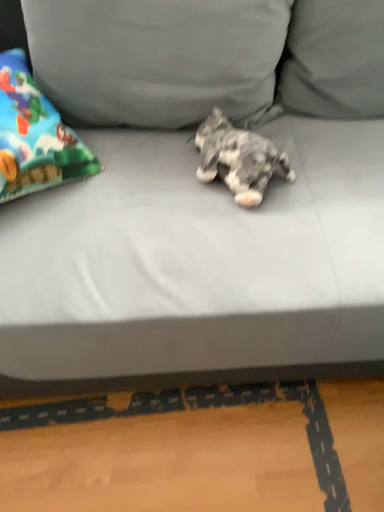
In order to face fluffy gray dog at center, should I rotate leftwards or rightwards?

Turn right by 5.921 degrees to look at fluffy gray dog at center.

What is the approximate width of fluffy gray dog at center?

The width of fluffy gray dog at center is 7.00 inches.

At what (x,y) coordinates should I click in order to perform the action: click on gray fabric couch at center. Please return your answer as a coordinate pair (x, y). Looking at the image, I should click on (200, 194).

The width and height of the screenshot is (384, 512). What are the coordinates of `fluffy gray dog at center` in the screenshot? It's located at (238, 158).

Which object is further away from the camera taking this photo, gray fabric pillow at upper center or gray fabric couch at center?

gray fabric pillow at upper center is further away from the camera.

Are gray fabric pillow at upper center and gray fabric couch at center located far from each other?

No, gray fabric pillow at upper center is not far from gray fabric couch at center.

Is gray fabric pillow at upper center to the right of gray fabric couch at center from the viewer's perspective?

No.

From a real-world perspective, is gray fabric pillow at upper center located higher than gray fabric couch at center?

Correct, in the physical world, gray fabric pillow at upper center is higher than gray fabric couch at center.

Is gray fabric couch at center inside the boundaries of gray fabric pillow at upper center, or outside?

gray fabric couch at center is located beyond the bounds of gray fabric pillow at upper center.

Looking at the image, does gray fabric couch at center seem bigger or smaller compared to gray fabric pillow at upper center?

In the image, gray fabric couch at center appears to be larger than gray fabric pillow at upper center.

How much distance is there between gray fabric couch at center and gray fabric pillow at upper center?

gray fabric couch at center is 5.54 inches from gray fabric pillow at upper center.

Could you tell me if gray fabric couch at center is facing gray fabric pillow at upper center?

No, gray fabric couch at center is not turned towards gray fabric pillow at upper center.

From a real-world perspective, between gray fabric couch at center and fluffy gray dog at center, who is vertically higher?

From a 3D spatial view, fluffy gray dog at center is above.

Which object is further away from the camera, gray fabric couch at center or fluffy gray dog at center?

fluffy gray dog at center is further away from the camera.

Is gray fabric couch at center placed right next to fluffy gray dog at center?

No, gray fabric couch at center is not next to fluffy gray dog at center.

How many degrees apart are the facing directions of gray fabric couch at center and fluffy gray dog at center?

They differ by 54.8 degrees in their facing directions.

From the picture: Which of these two, gray fabric pillow at upper center or fluffy gray dog at center, stands taller?

With more height is gray fabric pillow at upper center.

Between gray fabric pillow at upper center and fluffy gray dog at center, which one has smaller size?

Smaller between the two is fluffy gray dog at center.

Based on the photo, from a real-world perspective, which object rests below the other?

fluffy gray dog at center is physically lower.

How different are the orientations of gray fabric pillow at upper center and fluffy gray dog at center in degrees?

The angular difference between gray fabric pillow at upper center and fluffy gray dog at center is 49.2 degrees.

From a real-world perspective, which is physically below, fluffy gray dog at center or gray fabric couch at center?

gray fabric couch at center.

Does fluffy gray dog at center touch gray fabric couch at center?

No, fluffy gray dog at center is not next to gray fabric couch at center.

Does fluffy gray dog at center lie in front of gray fabric couch at center?

No, fluffy gray dog at center is further to the viewer.

Which of these two, fluffy gray dog at center or gray fabric pillow at upper center, is smaller?

With smaller size is fluffy gray dog at center.

In the scene shown: From the image's perspective, does fluffy gray dog at center appear lower than gray fabric pillow at upper center?

Yes, from the image's perspective, fluffy gray dog at center is below gray fabric pillow at upper center.

Does point (214, 135) come farther from viewer compared to point (281, 13)?

Yes, it is.

The width and height of the screenshot is (384, 512). What are the coordinates of `dog behind the gray fabric pillow at upper center` in the screenshot? It's located at (238, 158).

Locate an element on the screen. pillow above the gray fabric couch at center (from a real-world perspective) is located at coordinates (156, 58).

Where is `studio couch on the right of gray fabric pillow at upper center`? The width and height of the screenshot is (384, 512). studio couch on the right of gray fabric pillow at upper center is located at coordinates (200, 194).

From the image, which object appears to be nearer to fluffy gray dog at center, gray fabric couch at center or gray fabric pillow at upper center?

gray fabric couch at center.

From the image, which object appears to be nearer to gray fabric pillow at upper center, gray fabric couch at center or fluffy gray dog at center?

The object closer to gray fabric pillow at upper center is gray fabric couch at center.

Based on their spatial positions, is gray fabric pillow at upper center or gray fabric couch at center further from fluffy gray dog at center?

The object further to fluffy gray dog at center is gray fabric pillow at upper center.

Based on their spatial positions, is gray fabric pillow at upper center or fluffy gray dog at center closer to gray fabric couch at center?

The object closer to gray fabric couch at center is gray fabric pillow at upper center.

Based on their spatial positions, is fluffy gray dog at center or gray fabric couch at center further from gray fabric pillow at upper center?

Among the two, fluffy gray dog at center is located further to gray fabric pillow at upper center.

Which object lies further to the anchor point gray fabric couch at center, fluffy gray dog at center or gray fabric pillow at upper center?

fluffy gray dog at center lies further to gray fabric couch at center than the other object.

You are a GUI agent. You are given a task and a screenshot of the screen. Output one action in this format:
    pyautogui.click(x=<x>, y=<y>)
    Task: Click on the pillow located between gray fabric couch at center and fluffy gray dog at center in the depth direction
    
    Given the screenshot: What is the action you would take?
    pyautogui.click(x=156, y=58)